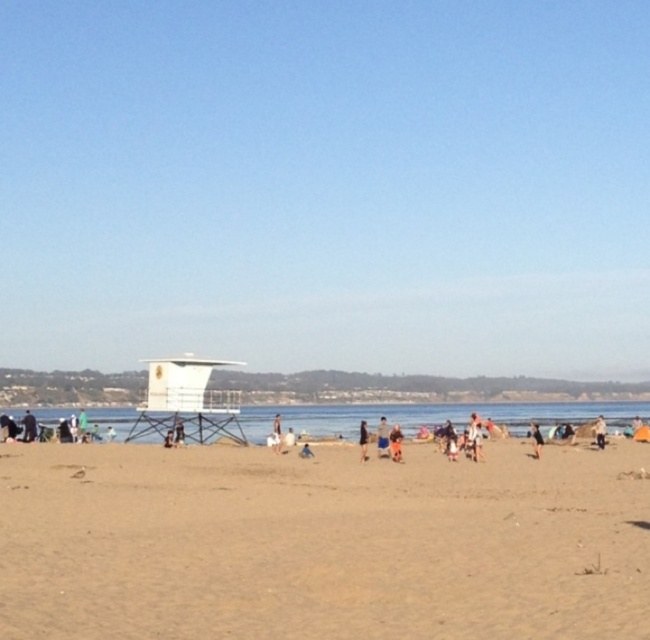
You are standing at the center of the image and want to walk to the brown sandy beach at lower left. Which direction should you face to head directly towards it?

Since the brown sandy beach at lower left is located at point (322, 541), you should face towards the lower left direction to head directly towards it.

You are a photographer trying to capture a candid shot of the tan fabric shorts at center and the dark blue jeans at center on the beach. Since you want to emphasize the size difference between them, which object should you zoom in on more to make the size difference more apparent?

The tan fabric shorts at center has a smaller size compared to dark blue jeans at center. To emphasize the size difference, you should zoom in more on the tan fabric shorts at center so its smaller size becomes more noticeable against the dark blue jeans at center.

You are a photographer trying to capture a candid shot of two people at the beach. You notice the tan fabric shorts at center and the dark blue jeans at center. Which pair of clothing items is positioned closer to your camera lens?

The tan fabric shorts at center is closer to the viewer than dark blue jeans at center, so the tan fabric shorts at center would be the one closer to your camera lens.